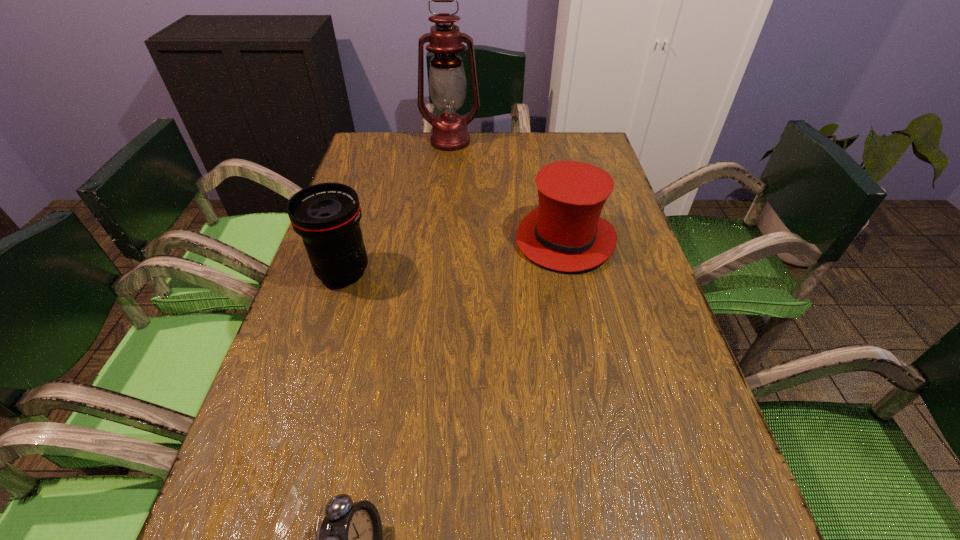
At what (x,y) coordinates should I click in order to perform the action: click on the farthest object. Please return your answer as a coordinate pair (x, y). The image size is (960, 540). Looking at the image, I should click on (447, 83).

This screenshot has width=960, height=540. In order to click on oil lamp in this screenshot , I will do `click(447, 83)`.

This screenshot has width=960, height=540. What are the coordinates of `telephoto lens` in the screenshot? It's located at (326, 215).

The width and height of the screenshot is (960, 540). In order to click on the rightmost object in this screenshot , I will do `click(565, 232)`.

The image size is (960, 540). In order to click on hat in this screenshot , I will do `click(565, 232)`.

In order to click on free region located 0.310m on the right of the farthest object in this screenshot , I will do `click(575, 141)`.

Image resolution: width=960 pixels, height=540 pixels. I want to click on free spot located on the front of the leftmost object, so click(330, 315).

The height and width of the screenshot is (540, 960). I want to click on vacant space located on the left of the second shortest object, so click(357, 239).

Find the location of a particular element. This screenshot has width=960, height=540. object present at the far edge is located at coordinates (447, 83).

Locate an element on the screen. Image resolution: width=960 pixels, height=540 pixels. object positioned at the left edge is located at coordinates (326, 215).